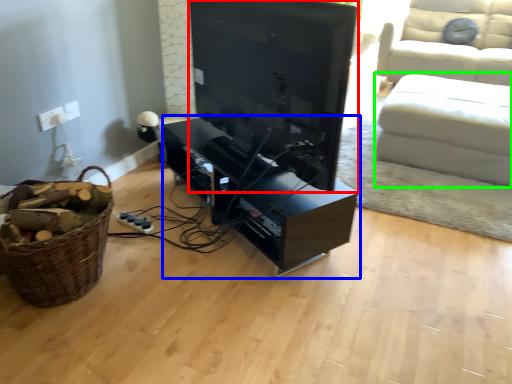
Question: Considering the real-world distances, which object is closest to television (highlighted by a red box)? entertainment center (highlighted by a blue box) or studio couch (highlighted by a green box).

Choices:
 (A) entertainment center
 (B) studio couch

Answer: (A)